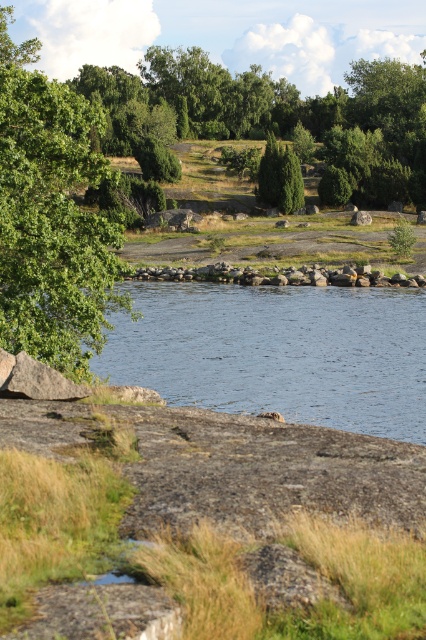
You are standing at the edge of the clear water at center and want to reach the green leafy tree at left. Which direction should you walk to get closer to the tree?

You should walk towards the left because the green leafy tree at left is located to the left side of the clear water at center.